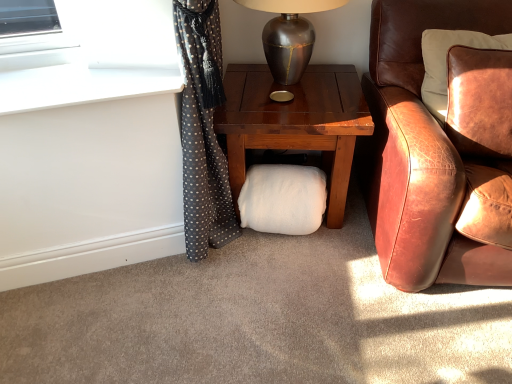
Question: Is metallic silver table lamp at upper center not within white smooth window sill at upper left?

Choices:
 (A) no
 (B) yes

Answer: (B)

Question: Can you confirm if metallic silver table lamp at upper center is taller than white smooth window sill at upper left?

Choices:
 (A) no
 (B) yes

Answer: (B)

Question: Does metallic silver table lamp at upper center appear on the left side of white smooth window sill at upper left?

Choices:
 (A) no
 (B) yes

Answer: (A)

Question: From the image's perspective, is metallic silver table lamp at upper center beneath white smooth window sill at upper left?

Choices:
 (A) no
 (B) yes

Answer: (A)

Question: Could you tell me if metallic silver table lamp at upper center is facing white smooth window sill at upper left?

Choices:
 (A) yes
 (B) no

Answer: (B)

Question: Visually, is brown leather chair at right positioned to the left or to the right of white smooth window sill at upper left?

Choices:
 (A) left
 (B) right

Answer: (B)

Question: Considering the positions of brown leather chair at right and white smooth window sill at upper left in the image, is brown leather chair at right wider or thinner than white smooth window sill at upper left?

Choices:
 (A) wide
 (B) thin

Answer: (A)

Question: From a real-world perspective, is brown leather chair at right above or below white smooth window sill at upper left?

Choices:
 (A) below
 (B) above

Answer: (A)

Question: Is brown leather chair at right bigger or smaller than white smooth window sill at upper left?

Choices:
 (A) small
 (B) big

Answer: (B)

Question: Looking at the image, does white fluffy pillow at center seem bigger or smaller compared to metallic silver table lamp at upper center?

Choices:
 (A) big
 (B) small

Answer: (B)

Question: Does point (282, 201) appear closer or farther from the camera than point (302, 23)?

Choices:
 (A) closer
 (B) farther

Answer: (B)

Question: Is white fluffy pillow at center taller or shorter than metallic silver table lamp at upper center?

Choices:
 (A) short
 (B) tall

Answer: (A)

Question: Considering their positions, is white fluffy pillow at center located in front of or behind metallic silver table lamp at upper center?

Choices:
 (A) behind
 (B) front

Answer: (A)

Question: From the image's perspective, is brown leather chair at right positioned above or below metallic silver table lamp at upper center?

Choices:
 (A) below
 (B) above

Answer: (A)

Question: In terms of height, does brown leather chair at right look taller or shorter compared to metallic silver table lamp at upper center?

Choices:
 (A) short
 (B) tall

Answer: (B)